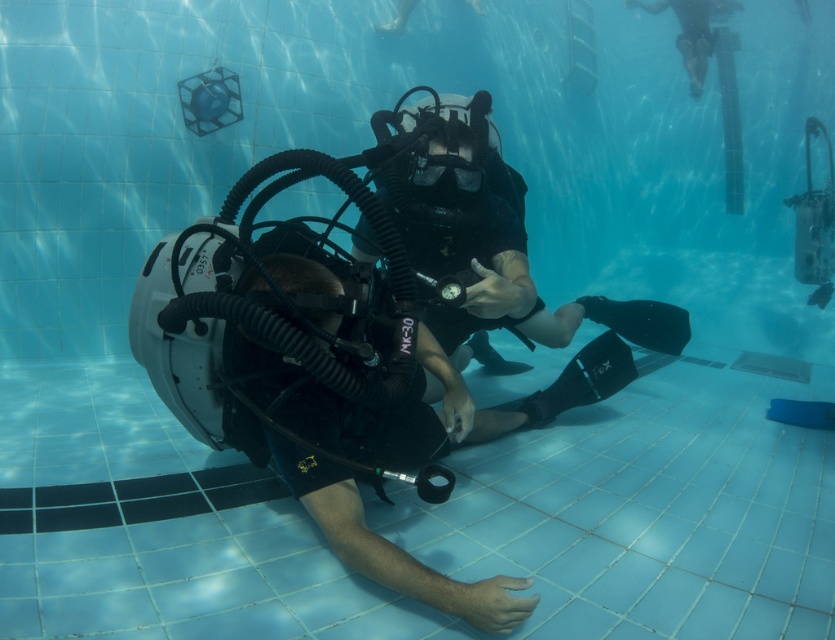
Question: Which object appears closest to the camera in this image?

Choices:
 (A) smooth skin at upper right
 (B) transparent plastic goggles at center

Answer: (B)

Question: Does smooth skin at upper right have a smaller size compared to transparent plastic goggles at center?

Choices:
 (A) yes
 (B) no

Answer: (B)

Question: Is smooth skin at upper right further to the viewer compared to transparent plastic goggles at center?

Choices:
 (A) yes
 (B) no

Answer: (A)

Question: Does smooth skin at upper right appear over transparent plastic goggles at center?

Choices:
 (A) no
 (B) yes

Answer: (B)